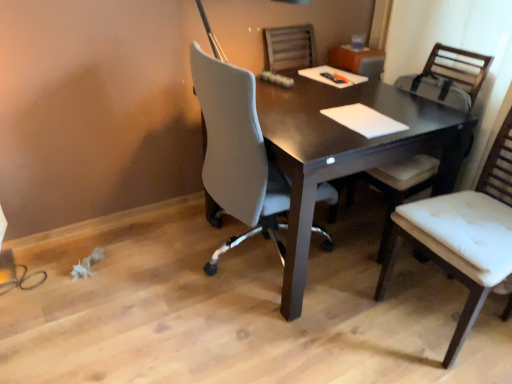
Question: Could you tell me if white fabric chair at right, which is the 1th chair from back to front, is facing dark wood desk at center?

Choices:
 (A) yes
 (B) no

Answer: (A)

Question: Is white fabric chair at right, which is the 1th chair from back to front, positioned far away from dark wood desk at center?

Choices:
 (A) yes
 (B) no

Answer: (B)

Question: Does white fabric chair at right, which is the 1th chair from back to front, appear on the right side of dark wood desk at center?

Choices:
 (A) no
 (B) yes

Answer: (B)

Question: Is white fabric chair at right, positioned as the 2th chair in front-to-back order, positioned beyond the bounds of dark wood desk at center?

Choices:
 (A) yes
 (B) no

Answer: (B)

Question: Is white fabric chair at right, which is the 1th chair from back to front, touching dark wood desk at center?

Choices:
 (A) yes
 (B) no

Answer: (B)

Question: Is white fabric chair at right, which is the 1th chair from back to front, oriented away from dark wood desk at center?

Choices:
 (A) yes
 (B) no

Answer: (A)

Question: Does white leather chair at right, which is the 1th chair in front-to-back order, come in front of dark wood desk at center?

Choices:
 (A) yes
 (B) no

Answer: (A)

Question: Is white leather chair at right, arranged as the second chair when viewed from the back, in contact with dark wood desk at center?

Choices:
 (A) no
 (B) yes

Answer: (A)

Question: Does white leather chair at right, arranged as the second chair when viewed from the back, have a larger size compared to dark wood desk at center?

Choices:
 (A) no
 (B) yes

Answer: (A)

Question: From a real-world perspective, is white leather chair at right, which is the 1th chair in front-to-back order, on top of dark wood desk at center?

Choices:
 (A) yes
 (B) no

Answer: (A)

Question: Is white leather chair at right, arranged as the second chair when viewed from the back, taller than dark wood desk at center?

Choices:
 (A) yes
 (B) no

Answer: (A)

Question: Is dark wood desk at center turned away from white fabric chair at right, positioned as the 2th chair in front-to-back order?

Choices:
 (A) no
 (B) yes

Answer: (A)